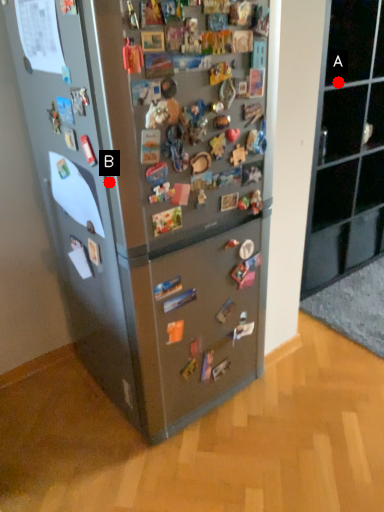
Question: Two points are circled on the image, labeled by A and B beside each circle. Which point is closer to the camera?

Choices:
 (A) A is closer
 (B) B is closer

Answer: (B)